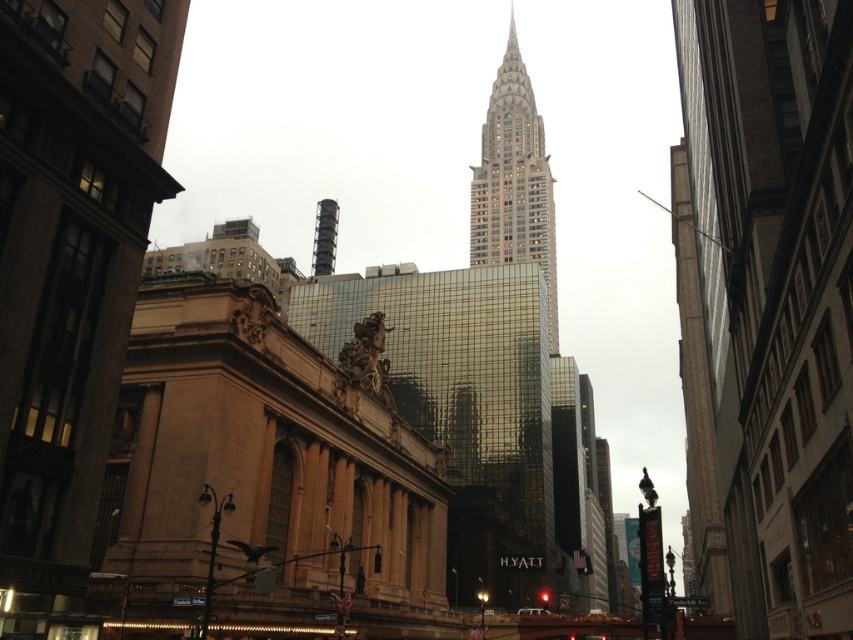
Measure the distance between gray stone tower at center and camera.

gray stone tower at center and camera are 533.87 feet apart.

Is gray stone tower at center taller than black concrete chimney at center?

Yes.

This screenshot has width=853, height=640. Identify the location of gray stone tower at center. (514, 180).